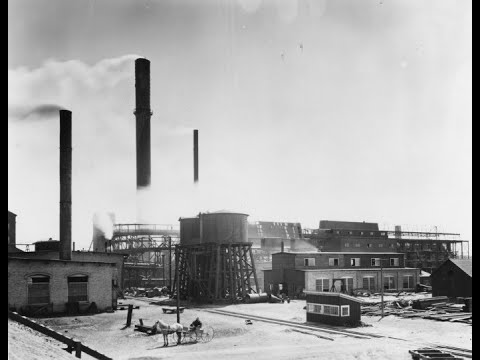
Locate an element on the screen. The height and width of the screenshot is (360, 480). booth is located at coordinates (332, 302).